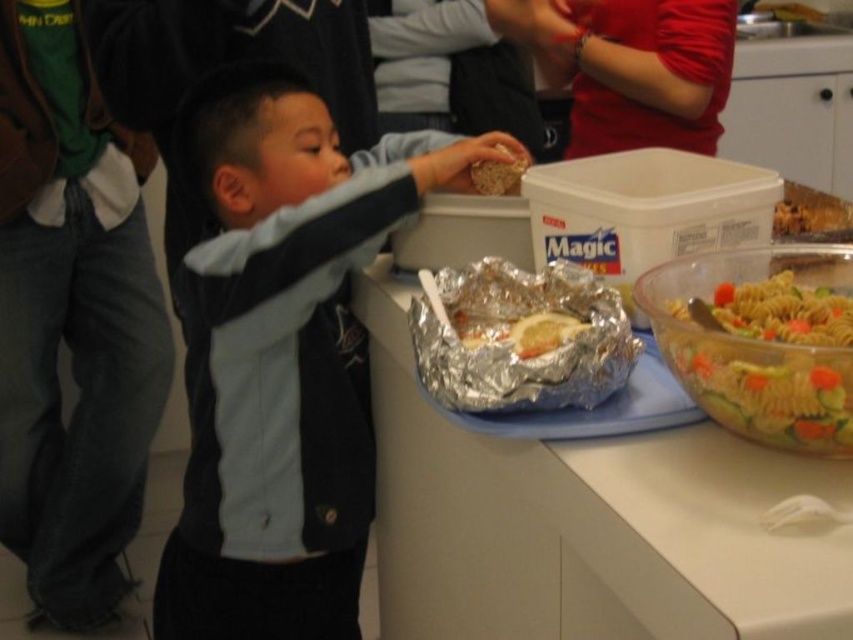
Question: Which of these objects is positioned farthest from the silver foil tray at center?

Choices:
 (A) red matte shirt at upper center
 (B) light blue jacket at center

Answer: (A)

Question: Is the position of silver foil tray at center less distant than that of multicolored pasta salad at right?

Choices:
 (A) yes
 (B) no

Answer: (A)

Question: Which point is closer to the camera?

Choices:
 (A) (732, 412)
 (B) (364, 323)
 (C) (660, 100)
 (D) (309, 125)

Answer: (A)

Question: Is silver foil tray at center smaller than red matte shirt at upper center?

Choices:
 (A) yes
 (B) no

Answer: (B)

Question: Which point is farther to the camera?

Choices:
 (A) (590, 4)
 (B) (718, 524)

Answer: (A)

Question: Is red matte shirt at upper center positioned behind matte brown rice at upper center?

Choices:
 (A) yes
 (B) no

Answer: (A)